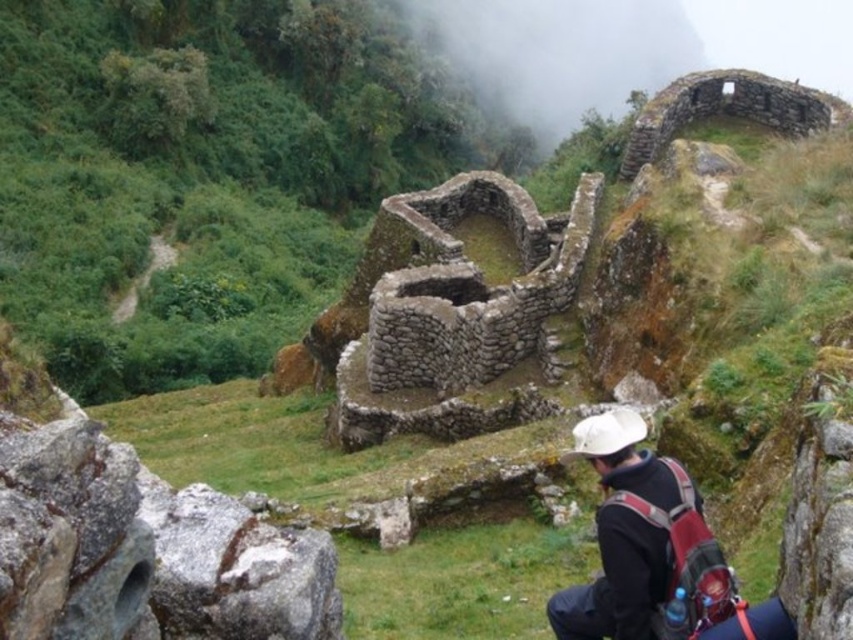
In the scene shown: You are standing in front of the ancient stone structure and want to take a clear photo of the foggy stone wall at upper center. Considering the distance, is it advisable to use a zoom lens?

The foggy stone wall at upper center is 235.19 meters away from the viewer. Using a zoom lens would be advisable to capture a clear image of the distant wall.

You are a photographer trying to capture the foggy stone wall at upper center and the black fabric backpack at lower right in the same frame. Based on their sizes, which object would appear larger in the photo?

The foggy stone wall at upper center might appear larger in the photo since it is wider than the black fabric backpack at lower right.

You are standing at the base of the ancient stone structure and notice the foggy stone wall at upper center. Based on its position, can you estimate its coordinates in the image?

The foggy stone wall at upper center is located at point coordinates of [556,52].